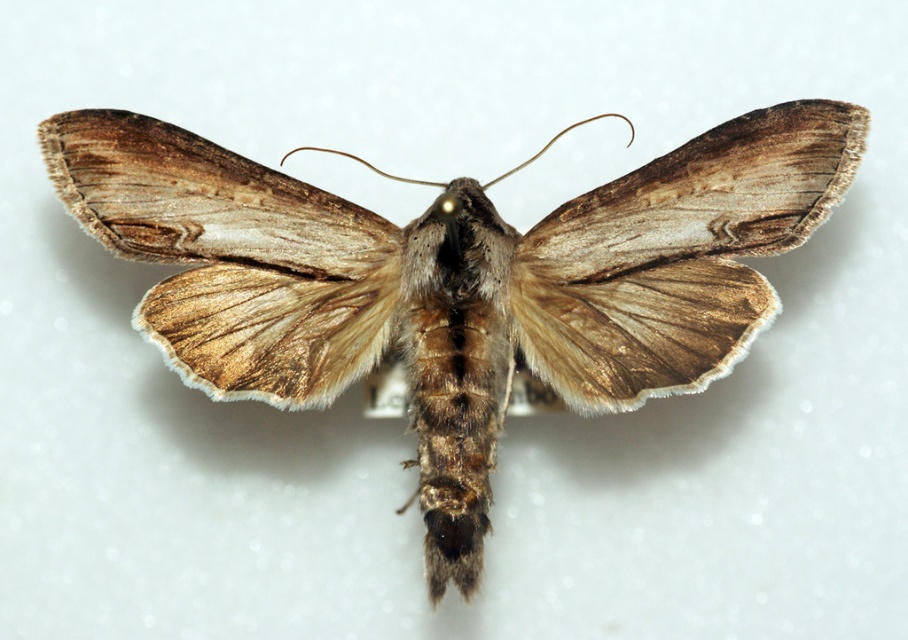
Question: Which point is closer to the camera taking this photo?

Choices:
 (A) (558, 280)
 (B) (166, 230)

Answer: (B)

Question: Does brown textured moth at center lie behind brown fuzzy moth wing at center?

Choices:
 (A) no
 (B) yes

Answer: (B)

Question: Which point is closer to the camera?

Choices:
 (A) (732, 321)
 (B) (456, 548)

Answer: (B)

Question: Among these points, which one is nearest to the camera?

Choices:
 (A) (595, 273)
 (B) (666, 364)

Answer: (B)

Question: Is brown textured moth at center below brown fuzzy moth wing at center?

Choices:
 (A) yes
 (B) no

Answer: (A)

Question: Where is brown textured moth at center located in relation to brown fuzzy moth wing at center in the image?

Choices:
 (A) below
 (B) above

Answer: (A)